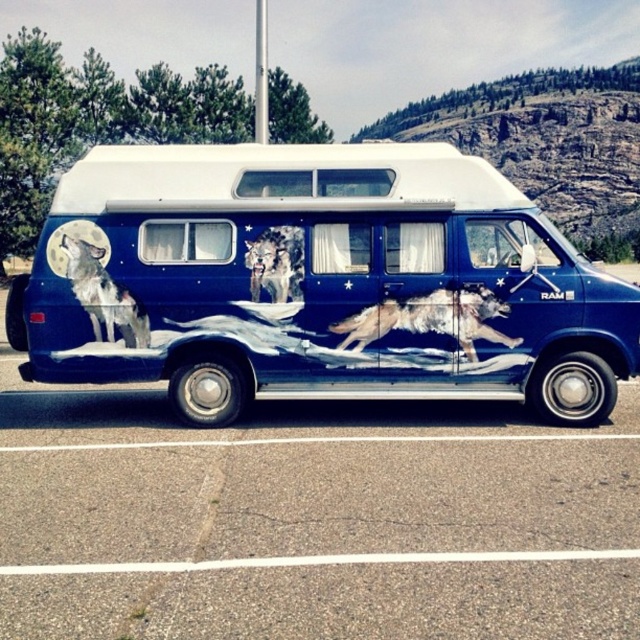
You are a delivery driver who needs to park your vehicle next to the blue glossy van at center. Your vehicle is 1.8 meters wide. Can you safely park your vehicle next to the shiny silver wolf at center without overlapping?

The blue glossy van at center is wider than the shiny silver wolf at center. However, the width of the shiny silver wolf at center isn not specified. Therefore, it is uncertain if your vehicle can park safely next to it without overlapping.

You are a painter who wants to add a new wolf illustration to the van. The new wolf should be placed between the gray fur wolf at left and the shiny metallic wolf at center. Considering their heights, which existing wolf should the new wolf be taller than to maintain a balanced composition?

The gray fur wolf at left is taller than the shiny metallic wolf at center. To maintain a balanced composition, the new wolf should be taller than the shiny metallic wolf at center but shorter than the gray fur wolf at left.

You are a delivery driver who needs to park your vehicle in a parking spot that can only accommodate vehicles up to 5 meters in length. Given the coordinates of the blue glossy van at center, can you determine if it will fit in the spot?

The blue glossy van at center is located at point coordinates, but without specific length information, it is impossible to determine if it will fit in the parking spot. Please provide the van length details.